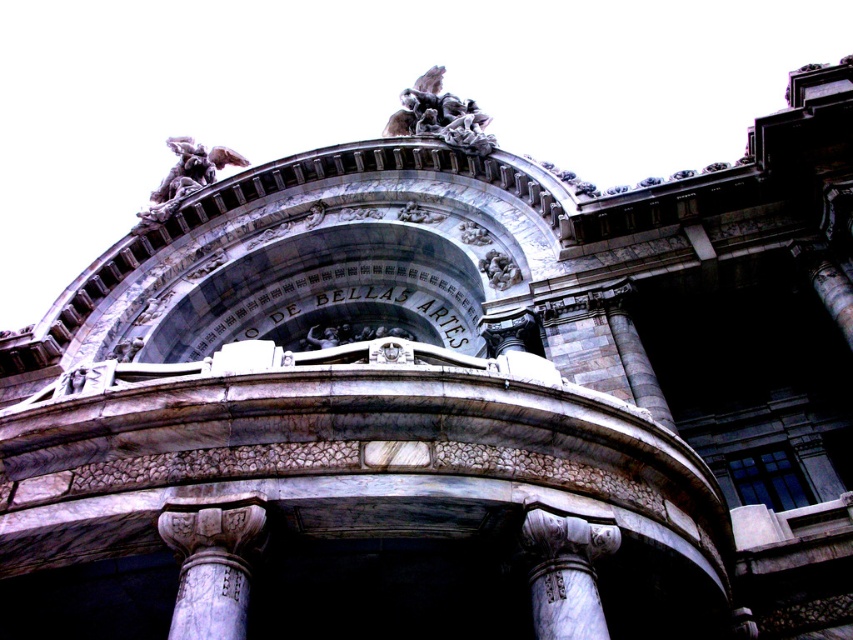
The width and height of the screenshot is (853, 640). In order to click on white marble column at lower center in this screenshot , I will do `click(566, 600)`.

Is white marble column at lower center taller than silver metallic sculpture at upper center?

No, white marble column at lower center is not taller than silver metallic sculpture at upper center.

Describe the element at coordinates (566, 600) in the screenshot. The width and height of the screenshot is (853, 640). I see `white marble column at lower center` at that location.

This screenshot has width=853, height=640. I want to click on white marble column at lower center, so tap(566, 600).

Is silver metallic sculpture at upper center to the right of gray stone cherub at center from the viewer's perspective?

Incorrect, silver metallic sculpture at upper center is not on the right side of gray stone cherub at center.

Is silver metallic sculpture at upper center shorter than gray stone cherub at center?

No, silver metallic sculpture at upper center is not shorter than gray stone cherub at center.

Identify the location of silver metallic sculpture at upper center. 440,115.

Locate an element on the screen. silver metallic sculpture at upper center is located at coordinates (440, 115).

How far apart are polished stone angel at upper center and polished stone sculpture at center?

They are 47.28 meters apart.

Is polished stone angel at upper center positioned at the back of polished stone sculpture at center?

Yes, it is behind polished stone sculpture at center.

Is point (234, 156) more distant than point (467, 241)?

Yes, it is behind point (467, 241).

Where is `polished stone angel at upper center`? polished stone angel at upper center is located at coordinates (184, 179).